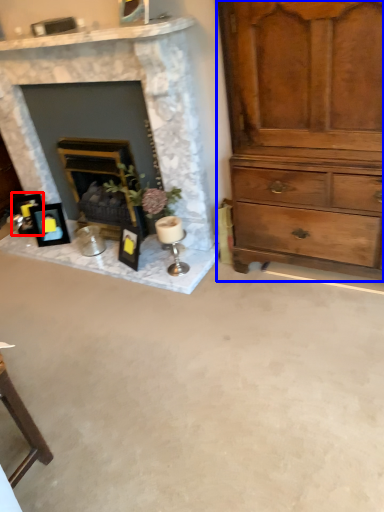
Question: Which object is closer to the camera taking this photo, picture frame (highlighted by a red box) or chest of drawers (highlighted by a blue box)?

Choices:
 (A) picture frame
 (B) chest of drawers

Answer: (B)